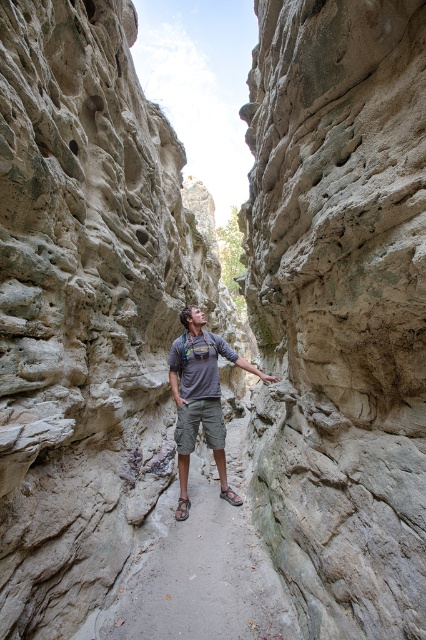
You are planning to take a photo of the gray sand at center and the gray fabric shirt at center from the same angle. Which object will appear wider in the photo?

The gray fabric shirt at center will appear wider in the photo because its width is greater than the gray sand at center.

You are a hiker in the canyon and want to take a photo of the gray rough rock at center and the gray fabric shirt at center in the same frame. Your camera has a maximum focus range that can capture objects up to 6 feet apart. Will both objects fit in focus?

The gray rough rock at center and gray fabric shirt at center are 6.29 feet apart, which exceeds the camera focus range of 6 feet. Therefore, both objects cannot be in focus simultaneously.

From the picture: You are hiking through the narrow canyon and need to place a small tent. The tent requires a flat area larger than the gray rough rock at center. Do you think the gray sand at center is suitable for setting up the tent?

The gray rough rock at center is smaller than the gray sand at center. Since the gray sand at center is larger, it can provide a flat area sufficient for setting up the tent.